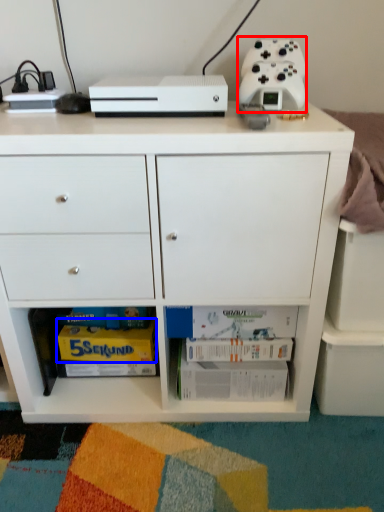
Question: Which object is closer to the camera taking this photo, appliance (highlighted by a red box) or magazine (highlighted by a blue box)?

Choices:
 (A) appliance
 (B) magazine

Answer: (A)